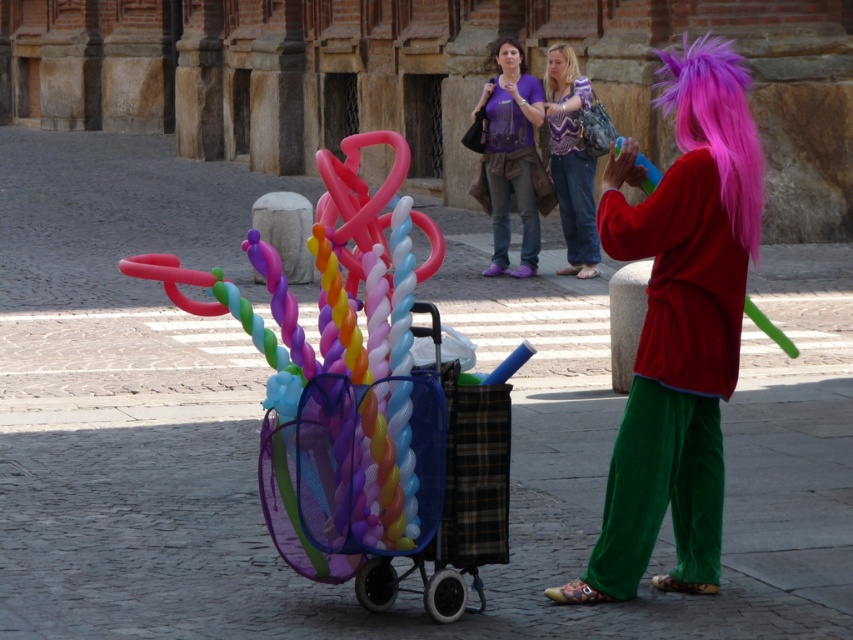
Question: Which point is closer to the camera?

Choices:
 (A) 566,74
 (B) 732,333
 (C) 524,61

Answer: (B)

Question: Estimate the real-world distances between objects in this image. Which object is closer to the striped fabric shirt at center?

Choices:
 (A) velvet red jacket at center
 (B) pink synthetic wig at upper center
 (C) purple silky hair at upper center

Answer: (B)

Question: Is purple matte shirt at center below purple silky hair at upper center?

Choices:
 (A) yes
 (B) no

Answer: (A)

Question: Which of these objects is positioned closest to the purple silky hair at upper center?

Choices:
 (A) velvet red jacket at center
 (B) striped fabric shirt at center

Answer: (B)

Question: Is purple matte shirt at center thinner than striped fabric shirt at center?

Choices:
 (A) no
 (B) yes

Answer: (A)

Question: Is the position of purple matte shirt at center less distant than that of purple silky hair at upper center?

Choices:
 (A) no
 (B) yes

Answer: (B)